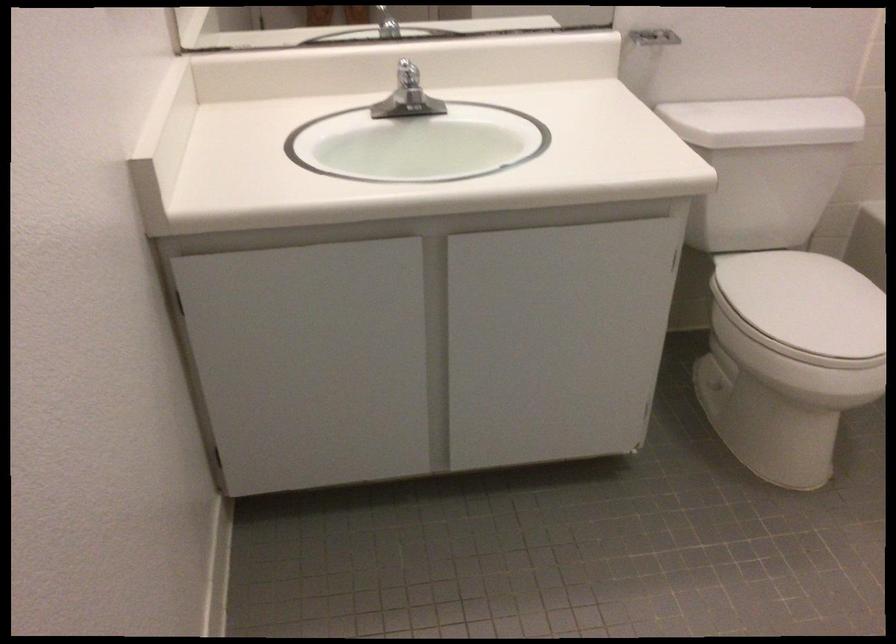
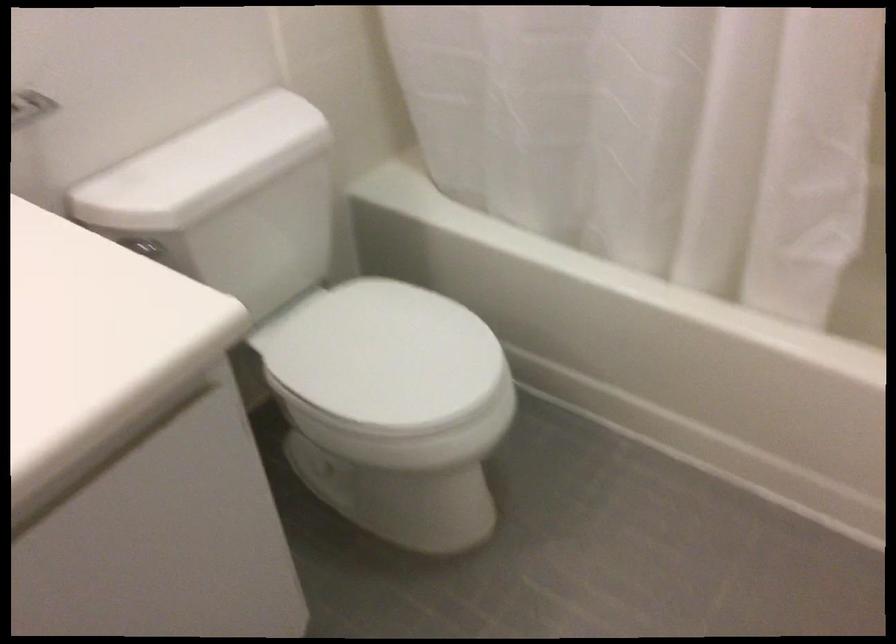
Question: The camera is either moving clockwise (left) or counter-clockwise (right) around the object. The first image is from the beginning of the video and the second image is from the end. Is the camera moving left or right when shooting the video?

Choices:
 (A) Left
 (B) Right

Answer: (A)